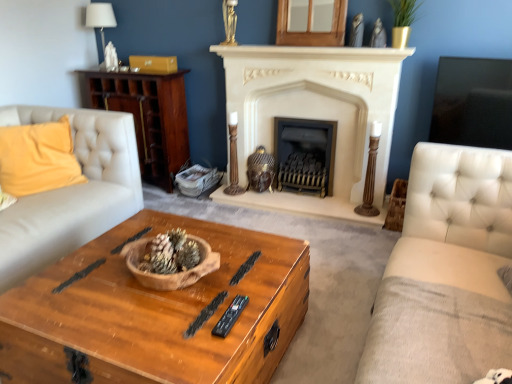
Question: Are white fabric lampshade at upper left and black plastic remote at center far apart?

Choices:
 (A) no
 (B) yes

Answer: (B)

Question: Is white fabric lampshade at upper left facing towards black plastic remote at center?

Choices:
 (A) yes
 (B) no

Answer: (B)

Question: Is white fabric lampshade at upper left beside black plastic remote at center?

Choices:
 (A) yes
 (B) no

Answer: (B)

Question: Is white fabric lampshade at upper left bigger than black plastic remote at center?

Choices:
 (A) no
 (B) yes

Answer: (B)

Question: Is white fabric lampshade at upper left to the right of black plastic remote at center from the viewer's perspective?

Choices:
 (A) yes
 (B) no

Answer: (B)

Question: Can you confirm if white fabric lampshade at upper left is positioned to the left of black plastic remote at center?

Choices:
 (A) yes
 (B) no

Answer: (A)

Question: Considering the relative positions of white stone fireplace at center, which appears as the second fireplace when viewed from the right, and white fabric lampshade at upper left in the image provided, is white stone fireplace at center, which appears as the second fireplace when viewed from the right, in front of white fabric lampshade at upper left?

Choices:
 (A) yes
 (B) no

Answer: (A)

Question: Is there a large distance between white stone fireplace at center, marked as the first fireplace in a left-to-right arrangement, and white fabric lampshade at upper left?

Choices:
 (A) no
 (B) yes

Answer: (B)

Question: Does white stone fireplace at center, which appears as the second fireplace when viewed from the right, have a smaller size compared to white fabric lampshade at upper left?

Choices:
 (A) no
 (B) yes

Answer: (A)

Question: Is white stone fireplace at center, marked as the first fireplace in a left-to-right arrangement, looking in the opposite direction of white fabric lampshade at upper left?

Choices:
 (A) yes
 (B) no

Answer: (B)

Question: Considering the relative positions of white stone fireplace at center, marked as the first fireplace in a left-to-right arrangement, and white fabric lampshade at upper left in the image provided, is white stone fireplace at center, marked as the first fireplace in a left-to-right arrangement, to the right of white fabric lampshade at upper left from the viewer's perspective?

Choices:
 (A) no
 (B) yes

Answer: (B)

Question: Is white stone fireplace at center, which appears as the second fireplace when viewed from the right, at the left side of white fabric lampshade at upper left?

Choices:
 (A) yes
 (B) no

Answer: (B)

Question: Is wooden cabinet at left wider than wooden chest at center?

Choices:
 (A) no
 (B) yes

Answer: (A)